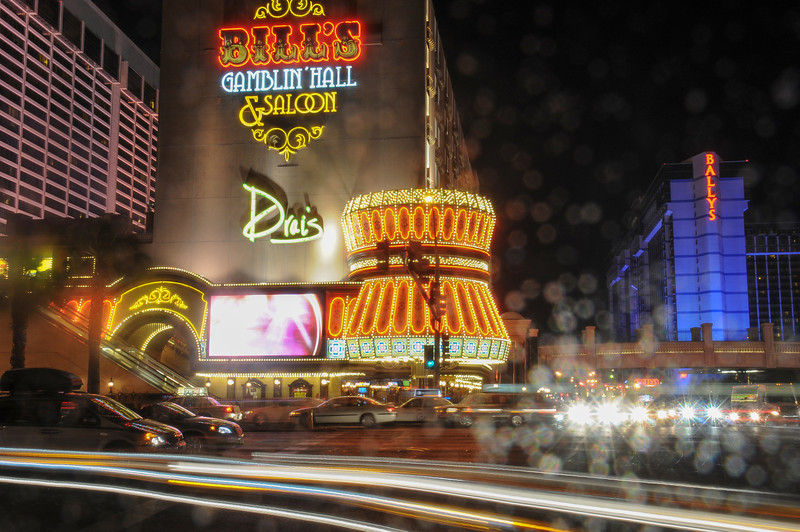
The image size is (800, 532). What are the coordinates of `light` in the screenshot? It's located at (605, 415).